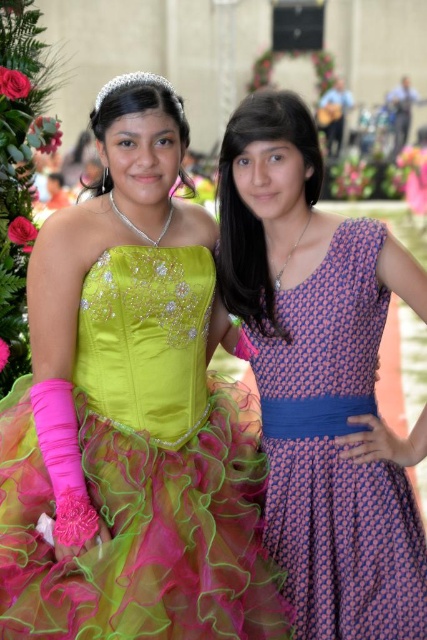
Question: Which of the following is the closest to the observer?

Choices:
 (A) click(x=18, y=452)
 (B) click(x=306, y=504)

Answer: (A)

Question: Which point is farther from the camera taking this photo?

Choices:
 (A) click(105, 86)
 (B) click(303, 595)

Answer: (A)

Question: Which of the following is the closest to the observer?

Choices:
 (A) clear crystal tiara at upper center
 (B) purple printed fabric dress at right
 (C) neon satin dress at left

Answer: (C)

Question: Where is purple printed fabric dress at right located in relation to clear crystal tiara at upper center in the image?

Choices:
 (A) right
 (B) left

Answer: (A)

Question: Can you confirm if neon satin dress at left is thinner than purple printed fabric dress at right?

Choices:
 (A) yes
 (B) no

Answer: (A)

Question: Is neon satin dress at left above clear crystal tiara at upper center?

Choices:
 (A) no
 (B) yes

Answer: (A)